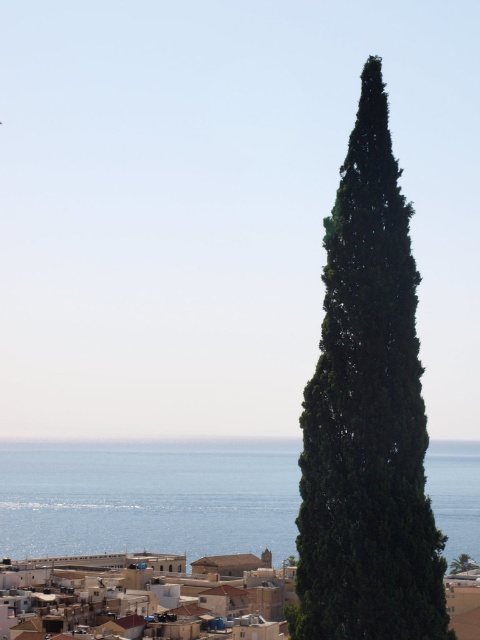
Question: Does blue liquid water at center appear under white matte building at lower center?

Choices:
 (A) no
 (B) yes

Answer: (B)

Question: In this image, where is green leafy cypress at center located relative to white matte building at lower center?

Choices:
 (A) right
 (B) left

Answer: (B)

Question: Which point appears closest to the camera in this image?

Choices:
 (A) (296, 454)
 (B) (357, 486)

Answer: (B)

Question: Which object is positioned closest to the green leafy cypress at center?

Choices:
 (A) white matte building at lower center
 (B) blue liquid water at center

Answer: (A)

Question: Is blue liquid water at center wider than white matte building at lower center?

Choices:
 (A) yes
 (B) no

Answer: (A)

Question: Which point is farther to the camera?

Choices:
 (A) white matte building at lower center
 (B) green leafy cypress at center

Answer: (A)